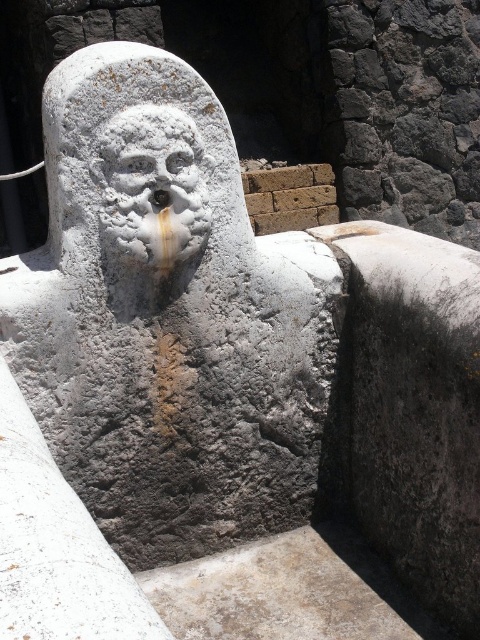
Is white stone head at center to the right of white stone face at center from the viewer's perspective?

No, white stone head at center is not to the right of white stone face at center.

Identify the location of white stone head at center. (140, 164).

Locate an element on the screen. white stone head at center is located at coordinates (140, 164).